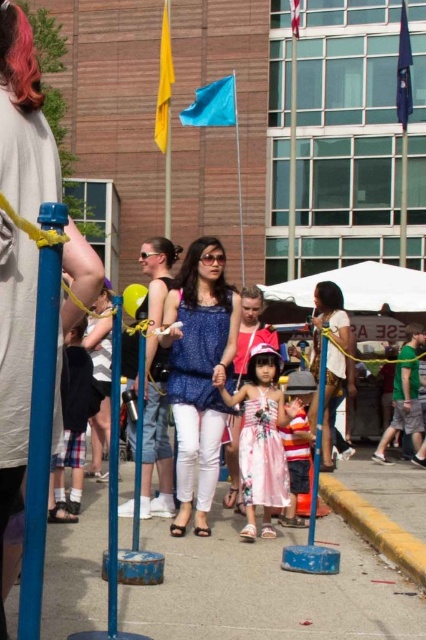
Is matte blue dress at center positioned behind blue textured blouse at center?

No, it is in front of blue textured blouse at center.

Does point (17, 56) come closer to viewer compared to point (184, 387)?

Yes, it is in front of point (184, 387).

Is point (0, 493) positioned after point (199, 493)?

No, (0, 493) is in front of (199, 493).

Image resolution: width=426 pixels, height=640 pixels. Find the location of `matte blue dress at center`. matte blue dress at center is located at coordinates (14, 368).

Is matte blue dress at center smaller than matte white blouse at center?

Indeed, matte blue dress at center has a smaller size compared to matte white blouse at center.

Can you confirm if matte blue dress at center is positioned to the right of matte white blouse at center?

Incorrect, matte blue dress at center is not on the right side of matte white blouse at center.

What do you see at coordinates (14, 368) in the screenshot? I see `matte blue dress at center` at bounding box center [14, 368].

Where is `matte blue dress at center`? The image size is (426, 640). matte blue dress at center is located at coordinates (14, 368).

Which of these two, blue plastic pole at left or striped cotton shirt at center, stands shorter?

Standing shorter between the two is blue plastic pole at left.

Describe the element at coordinates (40, 440) in the screenshot. I see `blue plastic pole at left` at that location.

Is point (46, 442) positioned before point (301, 371)?

Yes, point (46, 442) is closer to viewer.

Locate an element on the screen. The image size is (426, 640). blue plastic pole at left is located at coordinates tap(40, 440).